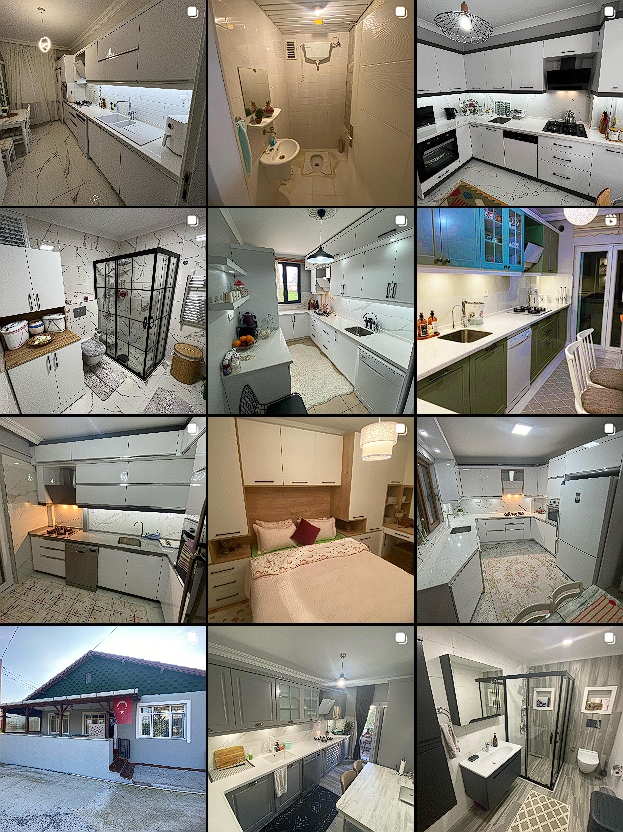
This screenshot has height=832, width=623. I want to click on cabinets in bedroom, so click(326, 474), click(300, 461), click(264, 458), click(220, 516), click(239, 562), click(240, 582), click(240, 595).